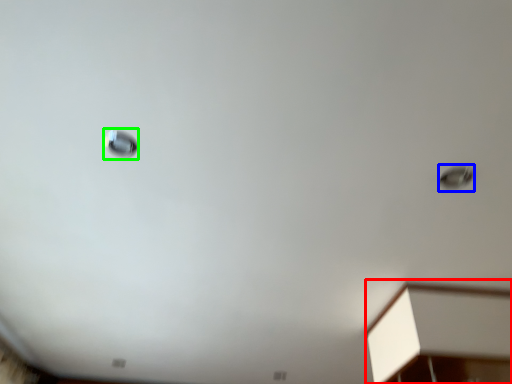
Question: Which is nearer to the furniture (highlighted by a red box)? droplight (highlighted by a blue box) or droplight (highlighted by a green box).

Choices:
 (A) droplight
 (B) droplight

Answer: (A)